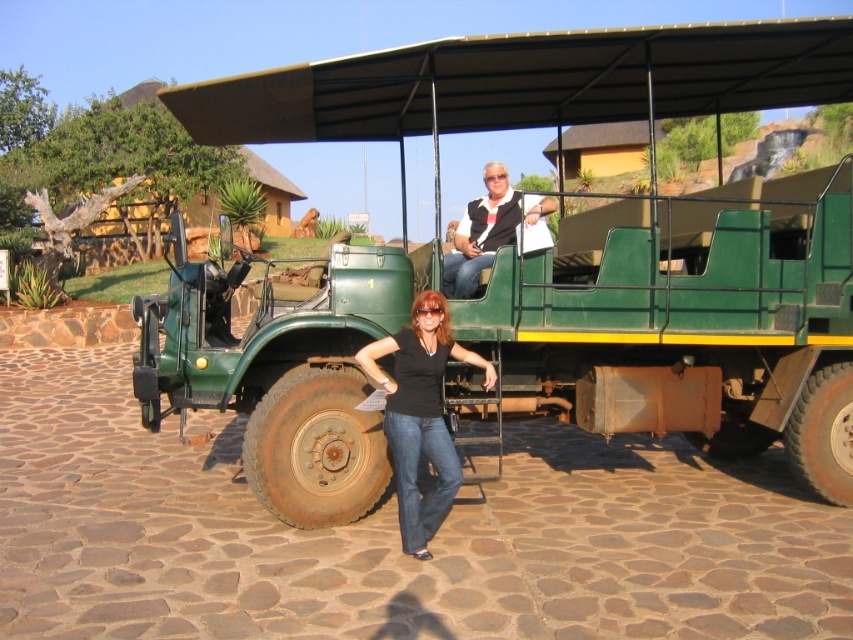
You are a photographer positioned at the edge of the scene. You need to capture a photo that includes both the rusty metal truck at center and the matte black vest at upper center. Based on their positions, which object should you adjust your camera angle to focus on first to ensure both are in frame?

Since the rusty metal truck at center is to the right of the matte black vest at upper center, you should first focus on the matte black vest at upper center to ensure both objects are within the frame, as it is positioned to the left of the truck.